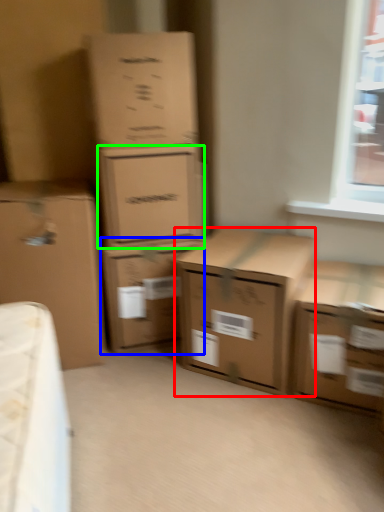
Question: Which is nearer to the box (highlighted by a red box)? box (highlighted by a blue box) or box (highlighted by a green box).

Choices:
 (A) box
 (B) box

Answer: (A)